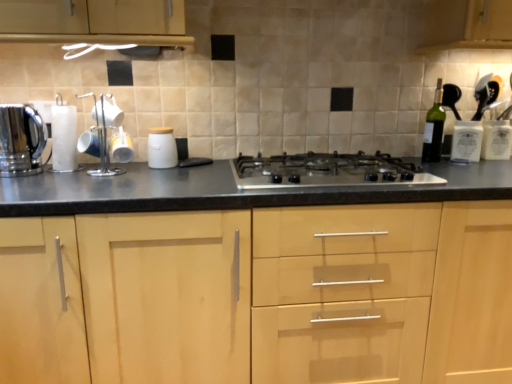
Locate an element on the screen. Image resolution: width=512 pixels, height=384 pixels. polished stainless steel kettle at left, which is the 2th kitchen appliance from right to left is located at coordinates (21, 140).

The height and width of the screenshot is (384, 512). Describe the element at coordinates (434, 128) in the screenshot. I see `green glass bottle at right` at that location.

Describe the element at coordinates (162, 148) in the screenshot. This screenshot has height=384, width=512. I see `white matte jar at center, the second kitchen appliance when ordered from left to right` at that location.

In order to face white matte jar at center, acting as the first kitchen appliance starting from the right, should I rotate leftwards or rightwards?

You should rotate left by 12.630 degrees.

Where is `light wood cabinet at center`? Image resolution: width=512 pixels, height=384 pixels. light wood cabinet at center is located at coordinates (298, 294).

What do you see at coordinates (327, 171) in the screenshot? I see `satin silver gas stove at center` at bounding box center [327, 171].

The width and height of the screenshot is (512, 384). I want to click on polished stainless steel kettle at left, the 1th kitchen appliance from the left, so click(x=21, y=140).

Which is nearer, (425, 157) or (1, 176)?

The point (1, 176) is closer to the camera.

Does green glass bottle at right contain polished stainless steel kettle at left, which is the 2th kitchen appliance from right to left?

No, green glass bottle at right does not contain polished stainless steel kettle at left, which is the 2th kitchen appliance from right to left.

The height and width of the screenshot is (384, 512). In order to click on kitchen appliance that is the 2nd object to the left of the green glass bottle at right, starting at the anchor in this screenshot , I will do `click(21, 140)`.

From a real-world perspective, which is physically above, green glass bottle at right or polished stainless steel kettle at left, the 1th kitchen appliance from the left?

In real-world perspective, green glass bottle at right is above.

Which of these two, metallic cup rack at left or green glass bottle at right, stands taller?

Standing taller between the two is green glass bottle at right.

Would you say metallic cup rack at left contains green glass bottle at right?

Actually, green glass bottle at right is outside metallic cup rack at left.

Looking at their sizes, would you say metallic cup rack at left is wider or thinner than green glass bottle at right?

In the image, metallic cup rack at left appears to be wider than green glass bottle at right.

Which object is positioned more to the right, metallic cup rack at left or green glass bottle at right?

From the viewer's perspective, green glass bottle at right appears more on the right side.

Considering the positions of objects polished stainless steel kettle at left, the 1th kitchen appliance from the left, and white matte jar at center, acting as the first kitchen appliance starting from the right, in the image provided, who is behind, polished stainless steel kettle at left, the 1th kitchen appliance from the left, or white matte jar at center, acting as the first kitchen appliance starting from the right,?

white matte jar at center, acting as the first kitchen appliance starting from the right, is behind.

In the scene shown: Is polished stainless steel kettle at left, which is the 2th kitchen appliance from right to left, wider than white matte jar at center, the second kitchen appliance when ordered from left to right?

Yes.

Which is in front, point (35, 145) or point (164, 158)?

The point (35, 145) is more forward.

Considering the relative sizes of polished stainless steel kettle at left, which is the 2th kitchen appliance from right to left, and white matte jar at center, acting as the first kitchen appliance starting from the right, in the image provided, is polished stainless steel kettle at left, which is the 2th kitchen appliance from right to left, bigger than white matte jar at center, acting as the first kitchen appliance starting from the right,?

Indeed, polished stainless steel kettle at left, which is the 2th kitchen appliance from right to left, has a larger size compared to white matte jar at center, acting as the first kitchen appliance starting from the right.

Find the location of a particular element. The image size is (512, 384). the 2nd kitchen appliance positioned above the satin silver gas stove at center (from the image's perspective) is located at coordinates (21, 140).

Is polished stainless steel kettle at left, the 1th kitchen appliance from the left, bigger than satin silver gas stove at center?

No, polished stainless steel kettle at left, the 1th kitchen appliance from the left, is not bigger than satin silver gas stove at center.

Considering the relative positions of polished stainless steel kettle at left, the 1th kitchen appliance from the left, and satin silver gas stove at center in the image provided, is polished stainless steel kettle at left, the 1th kitchen appliance from the left, behind satin silver gas stove at center?

Yes, it is.

Does polished stainless steel kettle at left, the 1th kitchen appliance from the left, have a greater width compared to satin silver gas stove at center?

No.

In terms of height, does light wood cabinet at center look taller or shorter compared to metallic cup rack at left?

light wood cabinet at center is taller than metallic cup rack at left.

From a real-world perspective, relative to metallic cup rack at left, is light wood cabinet at center vertically above or below?

Clearly, from a real-world perspective, light wood cabinet at center is below metallic cup rack at left.

Could metallic cup rack at left be considered to be inside light wood cabinet at center?

That's incorrect, metallic cup rack at left is not inside light wood cabinet at center.

Does light wood cabinet at center turn towards green glass bottle at right?

No, light wood cabinet at center is not turned towards green glass bottle at right.

Locate an element on the screen. bottle above the light wood cabinet at center (from a real-world perspective) is located at coordinates (434, 128).

Is light wood cabinet at center smaller than green glass bottle at right?

Result: No, light wood cabinet at center is not smaller than green glass bottle at right.

Considering the relative sizes of light wood cabinet at center and green glass bottle at right in the image provided, is light wood cabinet at center wider than green glass bottle at right?

Yes.

Is white matte jar at center, acting as the first kitchen appliance starting from the right, smaller than light wood cabinet at center?

Yes, white matte jar at center, acting as the first kitchen appliance starting from the right, is smaller than light wood cabinet at center.

Measure the distance from white matte jar at center, the second kitchen appliance when ordered from left to right, to light wood cabinet at center.

The distance of white matte jar at center, the second kitchen appliance when ordered from left to right, from light wood cabinet at center is 30.29 inches.

Are white matte jar at center, acting as the first kitchen appliance starting from the right, and light wood cabinet at center making contact?

There is a gap between white matte jar at center, acting as the first kitchen appliance starting from the right, and light wood cabinet at center.

Is the depth of white matte jar at center, the second kitchen appliance when ordered from left to right, less than that of light wood cabinet at center?

No, it is behind light wood cabinet at center.

This screenshot has width=512, height=384. What are the coordinates of `the 1st kitchen appliance below the green glass bottle at right (from a real-world perspective)` in the screenshot? It's located at (21, 140).

Find the location of a particular element. The image size is (512, 384). bottle positioned vertically above the metallic cup rack at left (from a real-world perspective) is located at coordinates (434, 128).

Based on the photo, estimate the real-world distances between objects in this image. Which object is further from satin silver gas stove at center, white matte jar at center, the second kitchen appliance when ordered from left to right, or polished stainless steel kettle at left, which is the 2th kitchen appliance from right to left?

polished stainless steel kettle at left, which is the 2th kitchen appliance from right to left, is further to satin silver gas stove at center.

From the picture: From the image, which object appears to be farther from white matte jar at center, acting as the first kitchen appliance starting from the right, metallic cup rack at left or satin silver gas stove at center?

satin silver gas stove at center is positioned further to the anchor white matte jar at center, acting as the first kitchen appliance starting from the right.

Considering their positions, is polished stainless steel kettle at left, which is the 2th kitchen appliance from right to left, positioned closer to green glass bottle at right than metallic cup rack at left?

The object closer to green glass bottle at right is metallic cup rack at left.

Considering their positions, is green glass bottle at right positioned closer to light wood cabinet at center than polished stainless steel kettle at left, the 1th kitchen appliance from the left?

green glass bottle at right.

When comparing their distances from polished stainless steel kettle at left, the 1th kitchen appliance from the left, does light wood cabinet at center or white matte jar at center, the second kitchen appliance when ordered from left to right, seem closer?

The object closer to polished stainless steel kettle at left, the 1th kitchen appliance from the left, is white matte jar at center, the second kitchen appliance when ordered from left to right.

Based on their spatial positions, is satin silver gas stove at center or metallic cup rack at left further from green glass bottle at right?

metallic cup rack at left.

When comparing their distances from polished stainless steel kettle at left, the 1th kitchen appliance from the left, does green glass bottle at right or satin silver gas stove at center seem closer?

satin silver gas stove at center is positioned closer to the anchor polished stainless steel kettle at left, the 1th kitchen appliance from the left.

Based on their spatial positions, is metallic cup rack at left or satin silver gas stove at center further from green glass bottle at right?

metallic cup rack at left is further to green glass bottle at right.

At what (x,y) coordinates should I click in order to perform the action: click on gas stove between polished stainless steel kettle at left, the 1th kitchen appliance from the left, and green glass bottle at right, in the horizontal direction. Please return your answer as a coordinate pair (x, y). The width and height of the screenshot is (512, 384). Looking at the image, I should click on (327, 171).

You are a GUI agent. You are given a task and a screenshot of the screen. Output one action in this format:
    pyautogui.click(x=<x>, y=<y>)
    Task: Click on the cabinetry between metallic cup rack at left and green glass bottle at right in the horizontal direction
    
    Given the screenshot: What is the action you would take?
    pyautogui.click(x=298, y=294)

Image resolution: width=512 pixels, height=384 pixels. What are the coordinates of `kitchen appliance located between metallic cup rack at left and light wood cabinet at center in the left-right direction` in the screenshot? It's located at point(162,148).

Locate an element on the screen. Image resolution: width=512 pixels, height=384 pixels. appliance between polished stainless steel kettle at left, the 1th kitchen appliance from the left, and light wood cabinet at center is located at coordinates tap(102, 143).